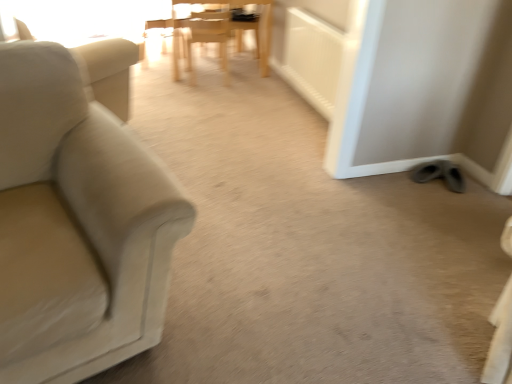
Measure the distance between point (x=20, y=351) and camera.

They are 3.65 feet apart.

Describe the element at coordinates (440, 174) in the screenshot. Image resolution: width=512 pixels, height=384 pixels. I see `gray suede shoes at lower right` at that location.

What do you see at coordinates (110, 72) in the screenshot?
I see `beige fabric swivel chair at left` at bounding box center [110, 72].

Locate an element on the screen. The image size is (512, 384). beige fabric couch at left, marked as the first chair in a bottom-to-top arrangement is located at coordinates (77, 217).

Which of these two, wooden chair at center, the 2th chair positioned from the bottom, or beige fabric swivel chair at left, stands taller?

beige fabric swivel chair at left is taller.

Which of these two, wooden chair at center, positioned as the 2th chair in back-to-front order, or beige fabric swivel chair at left, is wider?

beige fabric swivel chair at left.

Based on the photo, is wooden chair at center, positioned as the 2th chair in back-to-front order, further to the viewer compared to beige fabric swivel chair at left?

Yes, the depth of wooden chair at center, positioned as the 2th chair in back-to-front order, is greater than that of beige fabric swivel chair at left.

Where is `chair that is the 1st object directly below the beige fabric swivel chair at left (from a real-world perspective)`? chair that is the 1st object directly below the beige fabric swivel chair at left (from a real-world perspective) is located at coordinates (208, 38).

Is wooden chair at center, the 1th chair viewed from the back, looking in the opposite direction of wooden chair at center, positioned as the 2th chair in back-to-front order?

No, wooden chair at center, positioned as the 2th chair in back-to-front order, is not at the back of wooden chair at center, the 1th chair viewed from the back.

Which is closer, (174, 12) or (219, 49)?

Point (174, 12) appears to be closer to the viewer than point (219, 49).

From a real-world perspective, is wooden chair at center, the 1th chair viewed from the back, positioned over wooden chair at center, which is the second chair from front to back, based on gravity?

No, from a real-world perspective, wooden chair at center, the 1th chair viewed from the back, is not above wooden chair at center, which is the second chair from front to back.

Where is `the 1st chair in front of the wooden chair at center, acting as the 1th chair starting from the top, starting your count from the anchor`? the 1st chair in front of the wooden chair at center, acting as the 1th chair starting from the top, starting your count from the anchor is located at coordinates (208, 38).

Which is in front, point (57, 90) or point (269, 36)?

The point (57, 90) is more forward.

Is beige fabric couch at left, marked as the first chair in a bottom-to-top arrangement, at the left side of wooden chair at center, the third chair when ordered from bottom to top?

Yes.

Can we say beige fabric couch at left, arranged as the third chair when viewed from the back, lies outside wooden chair at center, the third chair when ordered from bottom to top?

Yes.

Between beige fabric couch at left, which is counted as the 3th chair, starting from the top, and wooden chair at center, the third chair when ordered from bottom to top, which one has smaller size?

wooden chair at center, the third chair when ordered from bottom to top.

Is point (461, 175) closer or farther from the camera than point (96, 63)?

Point (461, 175).

In the image, is gray suede shoes at lower right on the left side or the right side of beige fabric swivel chair at left?

From the image, it's evident that gray suede shoes at lower right is to the right of beige fabric swivel chair at left.

Does gray suede shoes at lower right come behind beige fabric swivel chair at left?

Yes, it is.

Between gray suede shoes at lower right and beige fabric swivel chair at left, which one has smaller width?

Thinner between the two is gray suede shoes at lower right.

Does beige fabric couch at left, which is counted as the 3th chair, starting from the top, turn towards gray suede shoes at lower right?

No, beige fabric couch at left, which is counted as the 3th chair, starting from the top, does not turn towards gray suede shoes at lower right.

From a real-world perspective, is beige fabric couch at left, which is counted as the 3th chair, starting from the top, on top of gray suede shoes at lower right?

Yes, from a real-world perspective, beige fabric couch at left, which is counted as the 3th chair, starting from the top, is above gray suede shoes at lower right.

Is beige fabric couch at left, marked as the first chair in a bottom-to-top arrangement, wider than gray suede shoes at lower right?

Yes, beige fabric couch at left, marked as the first chair in a bottom-to-top arrangement, is wider than gray suede shoes at lower right.

Which is closer to the camera, (178, 32) or (109, 104)?

Point (109, 104)

Is wooden chair at center, the third chair when ordered from bottom to top, oriented towards beige fabric swivel chair at left?

No, wooden chair at center, the third chair when ordered from bottom to top, is not oriented towards beige fabric swivel chair at left.

Does wooden chair at center, the third chair when ordered from bottom to top, have a larger size compared to beige fabric couch at left, arranged as the third chair when viewed from the back?

Incorrect, wooden chair at center, the third chair when ordered from bottom to top, is not larger than beige fabric couch at left, arranged as the third chair when viewed from the back.

Is wooden chair at center, the third chair when ordered from bottom to top, further to the viewer compared to beige fabric couch at left, marked as the first chair in a bottom-to-top arrangement?

Yes, it is.

Based on the photo, from a real-world perspective, is wooden chair at center, acting as the 1th chair starting from the top, beneath beige fabric couch at left, which is counted as the 3th chair, starting from the top?

Yes, from a real-world perspective, wooden chair at center, acting as the 1th chair starting from the top, is under beige fabric couch at left, which is counted as the 3th chair, starting from the top.

Is wooden chair at center, acting as the 1th chair starting from the top, completely or partially outside of beige fabric couch at left, which is the 1th chair in front-to-back order?

Yes, wooden chair at center, acting as the 1th chair starting from the top, is outside of beige fabric couch at left, which is the 1th chair in front-to-back order.

This screenshot has width=512, height=384. I want to click on the 2nd chair to the right when counting from the beige fabric swivel chair at left, so click(x=208, y=38).

Image resolution: width=512 pixels, height=384 pixels. In order to click on the 1st chair in front of the wooden chair at center, acting as the 1th chair starting from the top, counting from the anchor's position in this screenshot , I will do `click(208, 38)`.

When comparing their distances from gray suede shoes at lower right, does wooden chair at center, positioned as the 2th chair in back-to-front order, or beige fabric couch at left, marked as the first chair in a bottom-to-top arrangement, seem further?

wooden chair at center, positioned as the 2th chair in back-to-front order.

In the scene shown: Based on their spatial positions, is wooden chair at center, positioned as the 2th chair in back-to-front order, or beige fabric swivel chair at left closer to gray suede shoes at lower right?

beige fabric swivel chair at left is closer to gray suede shoes at lower right.

Estimate the real-world distances between objects in this image. Which object is closer to beige fabric swivel chair at left, gray suede shoes at lower right or wooden chair at center, the 2th chair positioned from the bottom?

wooden chair at center, the 2th chair positioned from the bottom, is closer to beige fabric swivel chair at left.

Which object lies nearer to the anchor point beige fabric swivel chair at left, wooden chair at center, which ranks as the 3th chair in front-to-back order, or beige fabric couch at left, which is counted as the 3th chair, starting from the top?

beige fabric couch at left, which is counted as the 3th chair, starting from the top.

Which object lies further to the anchor point beige fabric swivel chair at left, beige fabric couch at left, which is the 1th chair in front-to-back order, or wooden chair at center, acting as the 1th chair starting from the top?

wooden chair at center, acting as the 1th chair starting from the top, is positioned further to the anchor beige fabric swivel chair at left.

When comparing their distances from beige fabric swivel chair at left, does wooden chair at center, which is the second chair from front to back, or beige fabric couch at left, which is counted as the 3th chair, starting from the top, seem closer?

beige fabric couch at left, which is counted as the 3th chair, starting from the top, is positioned closer to the anchor beige fabric swivel chair at left.

Considering their positions, is beige fabric couch at left, marked as the first chair in a bottom-to-top arrangement, positioned further to wooden chair at center, the 2th chair positioned from the bottom, than beige fabric swivel chair at left?

Among the two, beige fabric couch at left, marked as the first chair in a bottom-to-top arrangement, is located further to wooden chair at center, the 2th chair positioned from the bottom.

When comparing their distances from beige fabric swivel chair at left, does gray suede shoes at lower right or beige fabric couch at left, marked as the first chair in a bottom-to-top arrangement, seem closer?

Based on the image, beige fabric couch at left, marked as the first chair in a bottom-to-top arrangement, appears to be nearer to beige fabric swivel chair at left.

I want to click on footwear positioned between beige fabric couch at left, which is counted as the 3th chair, starting from the top, and wooden chair at center, which is the second chair from front to back, from near to far, so click(440, 174).

Image resolution: width=512 pixels, height=384 pixels. What are the coordinates of `chair located between beige fabric couch at left, arranged as the third chair when viewed from the back, and wooden chair at center, which ranks as the 3th chair in front-to-back order, in the depth direction` in the screenshot? It's located at (208, 38).

Where is `chair located between beige fabric swivel chair at left and wooden chair at center, the 1th chair viewed from the back, in the depth direction`? chair located between beige fabric swivel chair at left and wooden chair at center, the 1th chair viewed from the back, in the depth direction is located at coordinates (208, 38).

Where is `chair between wooden chair at center, the 2th chair positioned from the bottom, and gray suede shoes at lower right`? chair between wooden chair at center, the 2th chair positioned from the bottom, and gray suede shoes at lower right is located at coordinates (231, 7).